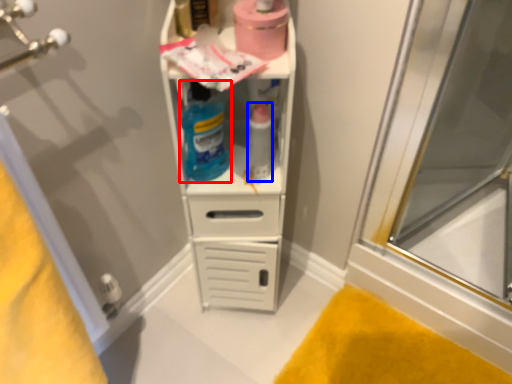
Question: Which of the following is the farthest to the observer, cleaning product (highlighted by a red box) or bottle (highlighted by a blue box)?

Choices:
 (A) cleaning product
 (B) bottle

Answer: (B)